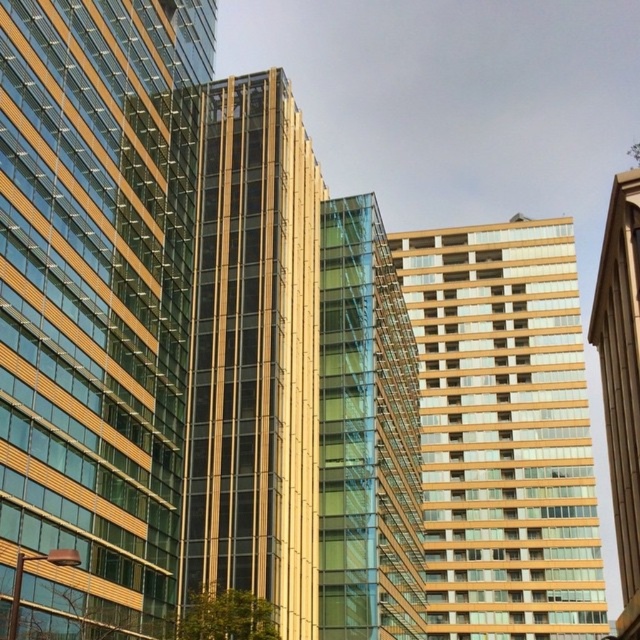
Is gold glass tower at center taller than green glass building at center?

No.

Who is lower down, gold glass tower at center or green glass building at center?

green glass building at center is below.

Does point (292, 333) come behind point (337, 371)?

No, (292, 333) is closer to viewer.

This screenshot has height=640, width=640. Find the location of `gold glass tower at center`. gold glass tower at center is located at coordinates (253, 355).

Does point (579, 420) come closer to viewer compared to point (630, 616)?

No, it is behind (630, 616).

Between gold glass building at center and gold glass tower at right, which one appears on the right side from the viewer's perspective?

Positioned to the right is gold glass tower at right.

Is point (525, 300) farther from viewer compared to point (636, 522)?

Yes, point (525, 300) is behind point (636, 522).

Find the location of a particular element. The width and height of the screenshot is (640, 640). gold glass building at center is located at coordinates (x=502, y=432).

Who is more forward, (390, 493) or (600, 369)?

Point (390, 493) is in front.

Can you confirm if green glass building at center is bigger than gold glass tower at right?

No.

Does point (330, 428) come closer to viewer compared to point (621, 209)?

No, (330, 428) is further to viewer.

Identify the location of green glass building at center. (365, 435).